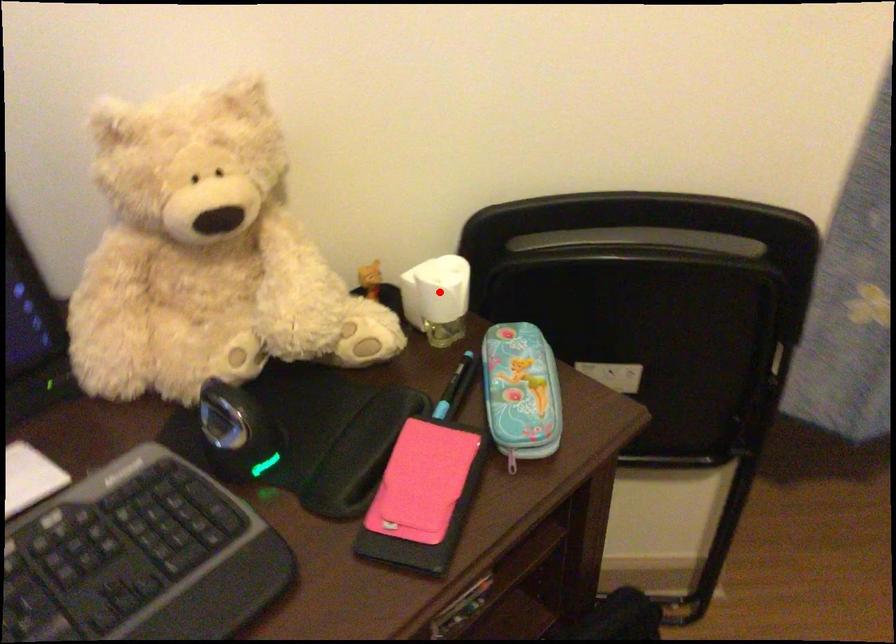
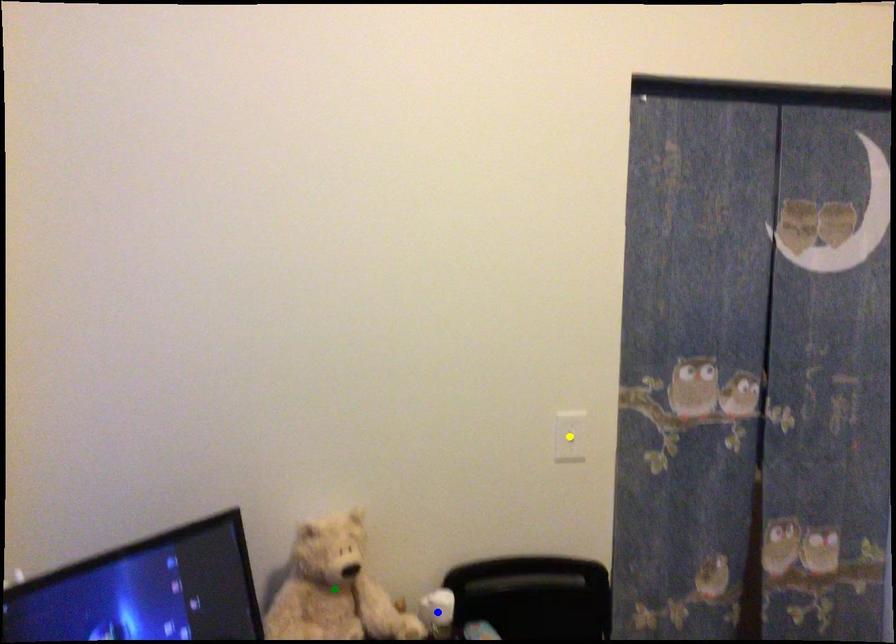
Question: I am providing you with two images of the same scene from different viewpoints. A red point is marked on the first image. You are given multiple points on the second image. Which point in image 2 is actually the same real-world point as the red point in image 1?

Choices:
 (A) yellow point
 (B) blue point
 (C) green point

Answer: (B)